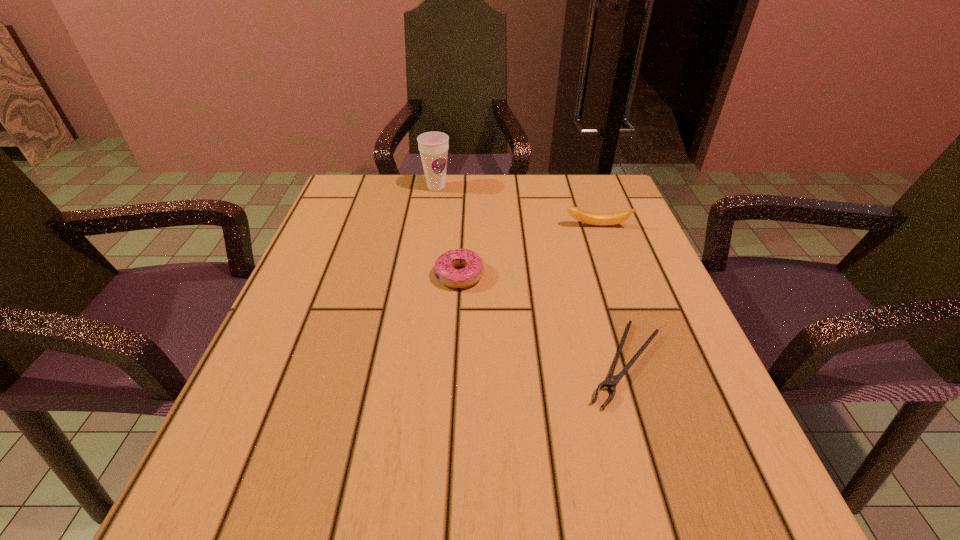
Locate an element on the screen. Image resolution: width=960 pixels, height=540 pixels. cup is located at coordinates (433, 146).

Locate an element on the screen. This screenshot has height=540, width=960. the tallest object is located at coordinates click(433, 146).

Locate an element on the screen. This screenshot has width=960, height=540. the second tallest object is located at coordinates (600, 219).

This screenshot has width=960, height=540. What are the coordinates of `banana` in the screenshot? It's located at (600, 219).

Find the location of a particular element. The width and height of the screenshot is (960, 540). doughnut is located at coordinates (473, 270).

At what (x,y) coordinates should I click in order to perform the action: click on the third tallest object. Please return your answer as a coordinate pair (x, y). The image size is (960, 540). Looking at the image, I should click on (473, 270).

Image resolution: width=960 pixels, height=540 pixels. I want to click on the nearest object, so click(611, 381).

What are the coordinates of `tongs` in the screenshot? It's located at (611, 381).

This screenshot has height=540, width=960. I want to click on vacant region located 0.070m on the front of the cup, so click(x=433, y=210).

In order to click on free space located 0.090m at the stem of the banana in this screenshot , I will do point(607,254).